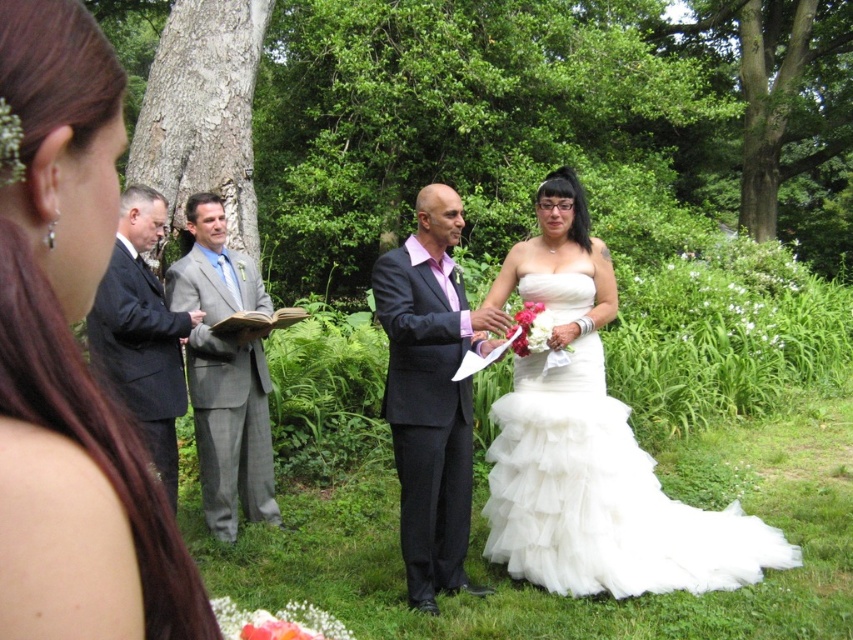
Between matte black suit at center and gray suit at center, which one appears on the left side from the viewer's perspective?

From the viewer's perspective, gray suit at center appears more on the left side.

Between point (390, 410) and point (218, 308), which one is positioned behind?

The point (218, 308) is more distant.

I want to click on matte black suit at center, so click(431, 394).

Between matte black suit at center and dark gray suit at left, which one is positioned higher?

dark gray suit at left is higher up.

Which is behind, point (410, 378) or point (178, 323)?

Point (178, 323)

Which is behind, point (450, 531) or point (140, 312)?

The point (140, 312) is more distant.

You are a GUI agent. You are given a task and a screenshot of the screen. Output one action in this format:
    pyautogui.click(x=<x>, y=<y>)
    Task: Click on the matte black suit at center
    
    Given the screenshot: What is the action you would take?
    pyautogui.click(x=431, y=394)

Who is taller, white tulle dress at center or dark gray suit at left?

With more height is dark gray suit at left.

Is white tulle dress at center thinner than dark gray suit at left?

No, white tulle dress at center is not thinner than dark gray suit at left.

Does point (675, 529) come behind point (143, 282)?

No, (675, 529) is closer to viewer.

Find the location of a particular element. white tulle dress at center is located at coordinates (602, 496).